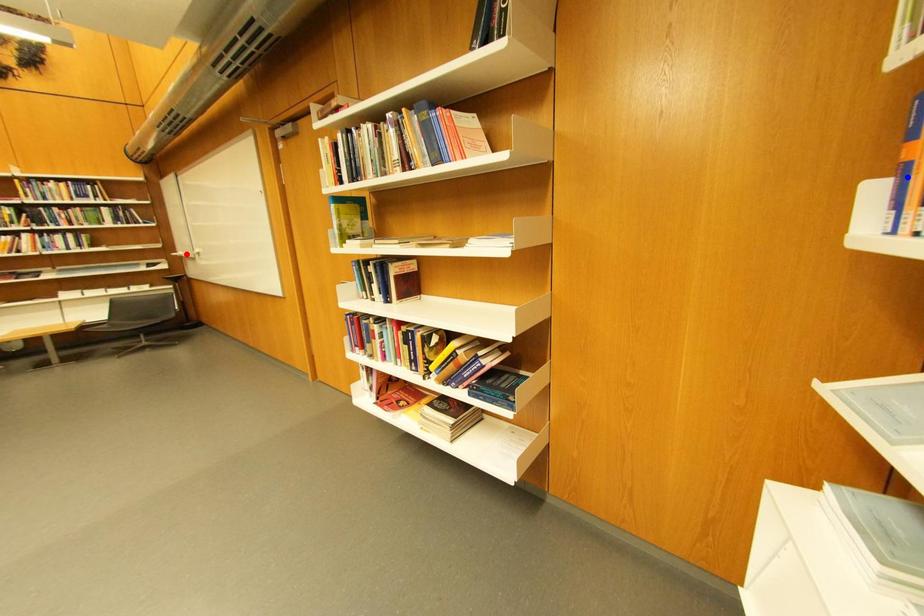
Question: Which of the two points in the image is closer to the camera?

Choices:
 (A) Blue point is closer.
 (B) Red point is closer.

Answer: (A)